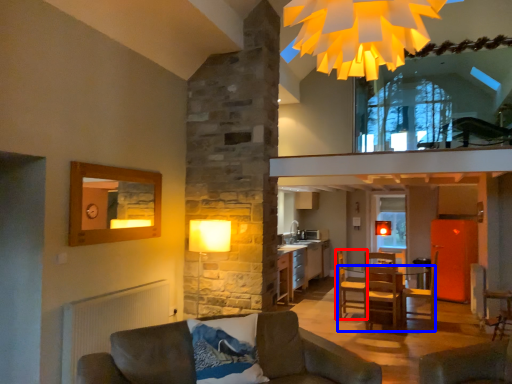
Question: Which point is closer to the camera, armchair (highlighted by a red box) or table (highlighted by a blue box)?

Choices:
 (A) armchair
 (B) table

Answer: (B)